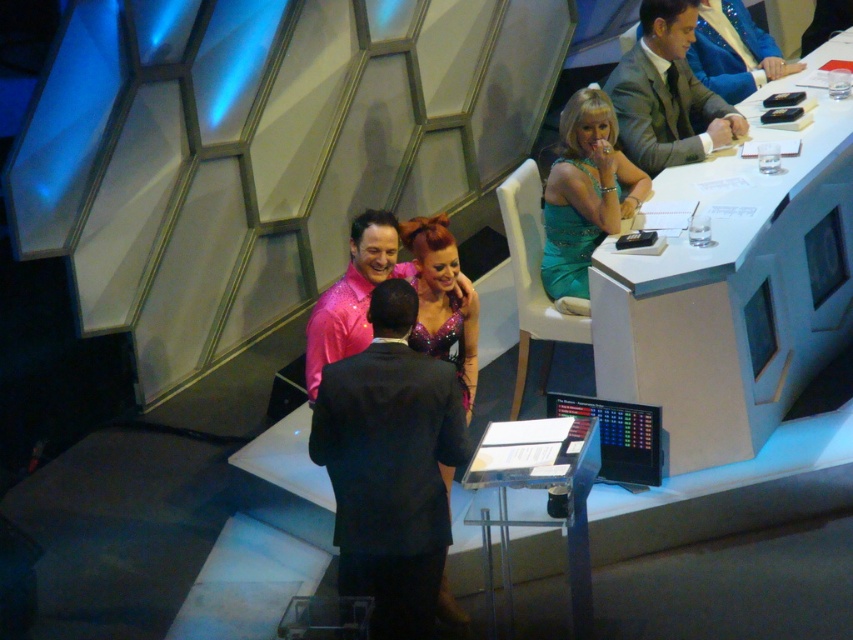
Question: Which of the following is the farthest from the observer?

Choices:
 (A) (763, 291)
 (B) (350, 536)
 (C) (654, 97)
 (D) (425, 324)

Answer: (C)

Question: Observing the image, what is the correct spatial positioning of matte gray suit at upper right in reference to sparkly purple dress at center?

Choices:
 (A) left
 (B) right

Answer: (B)

Question: Is white plastic table at upper right closer to the viewer compared to teal satin dress at upper right?

Choices:
 (A) no
 (B) yes

Answer: (B)

Question: Which point is farther from the camera taking this photo?

Choices:
 (A) (654, 109)
 (B) (428, 467)
 (C) (546, 182)

Answer: (A)

Question: Which point is closer to the camera?

Choices:
 (A) white plastic table at upper right
 (B) black satin suit at center
 (C) sparkly purple dress at center

Answer: (B)

Question: Can you confirm if white plastic table at upper right is positioned above sparkly purple dress at center?

Choices:
 (A) yes
 (B) no

Answer: (A)